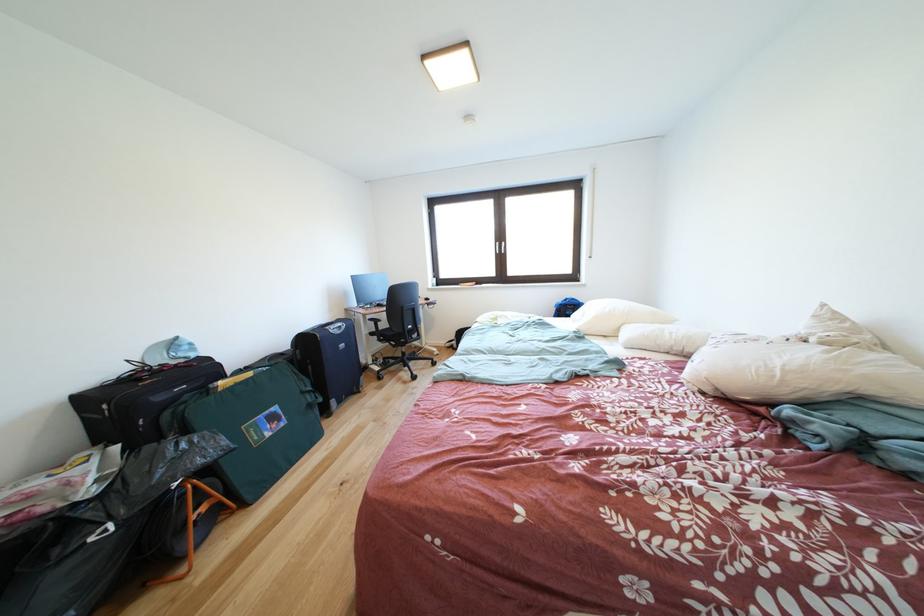
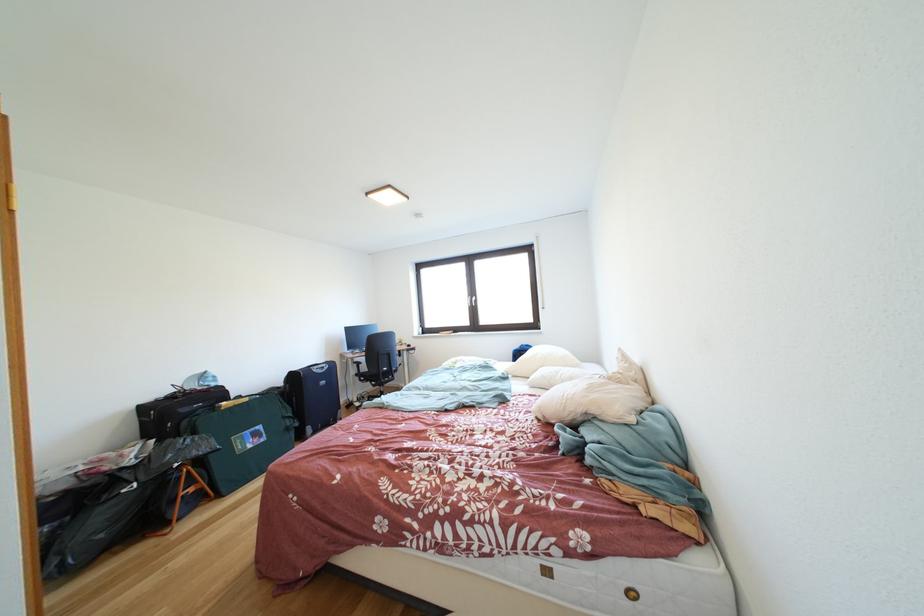
Find the pixel in the second image that matches the point at 403,351 in the first image.

(383, 391)